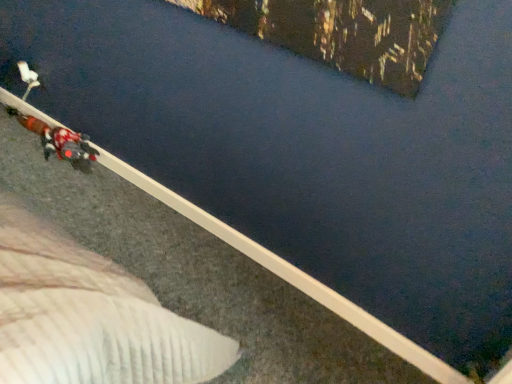
This screenshot has height=384, width=512. In order to click on vacant area in front of velvet-like red coat at lower left in this screenshot , I will do `click(46, 180)`.